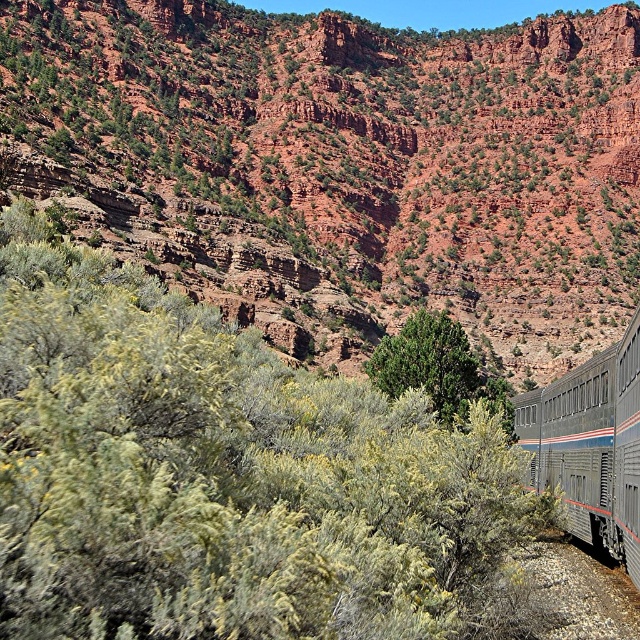
You are standing at the base of the cliff and see the point marked at coordinates (342, 166). What does this point indicate?

The point at (342, 166) marks the rustic rock formation at upper center.